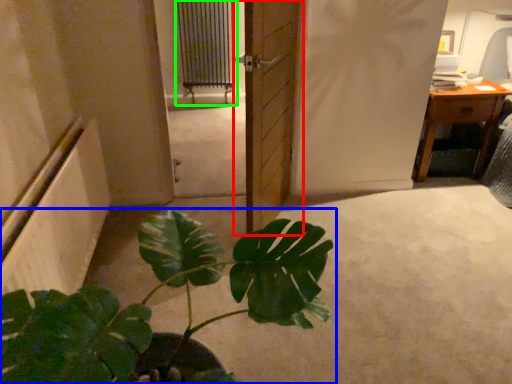
Question: Considering the real-world distances, which object is closest to door (highlighted by a red box)? houseplant (highlighted by a blue box) or radiator (highlighted by a green box).

Choices:
 (A) houseplant
 (B) radiator

Answer: (A)